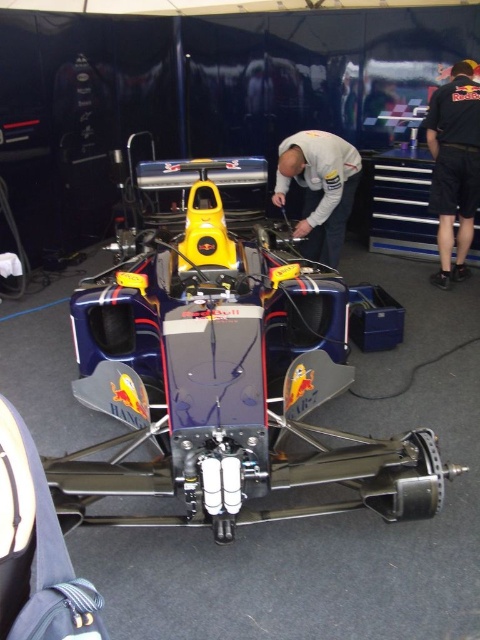
You are standing in front of the Formula One car and want to determine which of the two points, point (442,205) or point (294,164), is closer to you. Based on their positions, which point is nearer?

Point (294,164) is closer to you because it is less further to the camera than point (442,205).

You are a pit crew member who needs to lift the metallic blue race car at center to access its undercarriage. Considering the height of the white matte shirt at center, which is worn by your colleague, can you estimate if the car is taller than your colleague?

The metallic blue race car at center is taller than the white matte shirt at center, so the car is taller than your colleague wearing the white matte shirt at center.

Based on the photo, you are a mechanic in the garage. You need to determine if the metallic blue race car at center can fit through a doorway that is the same width as the black fabric pants at right. Can it fit?

The metallic blue race car at center is larger in size than black fabric pants at right, so it cannot fit through the doorway that is the same width as the black fabric pants at right.